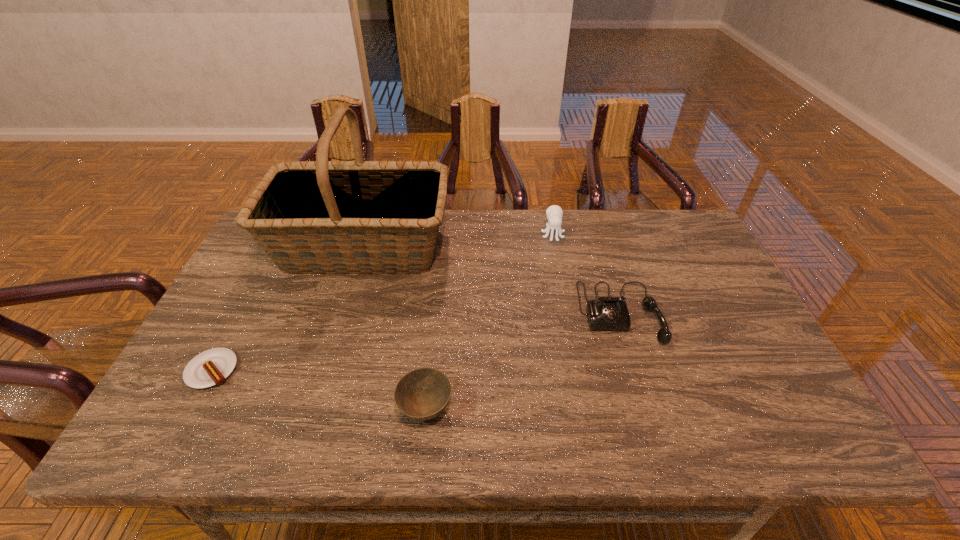
Find the location of a particular element. This screenshot has width=960, height=540. basket is located at coordinates (x=311, y=217).

Find the location of `octopus`. octopus is located at coordinates (554, 213).

The image size is (960, 540). What are the coordinates of `telephone` in the screenshot? It's located at (608, 313).

Where is `bowl`? The image size is (960, 540). bowl is located at coordinates (421, 394).

Find the location of a particular element. sausage is located at coordinates (211, 367).

Find the location of a particular element. The width and height of the screenshot is (960, 540). free region located by the handle of the basket is located at coordinates (554, 247).

You are a GUI agent. You are given a task and a screenshot of the screen. Output one action in this format:
    pyautogui.click(x=<x>, y=<y>)
    Task: Click on the free region located on the front-facing side of the octopus
    The width and height of the screenshot is (960, 540).
    Given the screenshot: What is the action you would take?
    pyautogui.click(x=564, y=295)

Locate an element on the screen. The width and height of the screenshot is (960, 540). vacant space located 0.090m on the dial of the telephone is located at coordinates (640, 378).

Identify the location of vacant space positioned 0.120m on the back of the fourth tallest object. (432, 345).

You are a GUI agent. You are given a task and a screenshot of the screen. Output one action in this format:
    pyautogui.click(x=<x>, y=<y>)
    Task: Click on the free space located on the back of the sausage
    The height and width of the screenshot is (540, 960).
    Given the screenshot: What is the action you would take?
    pyautogui.click(x=250, y=299)